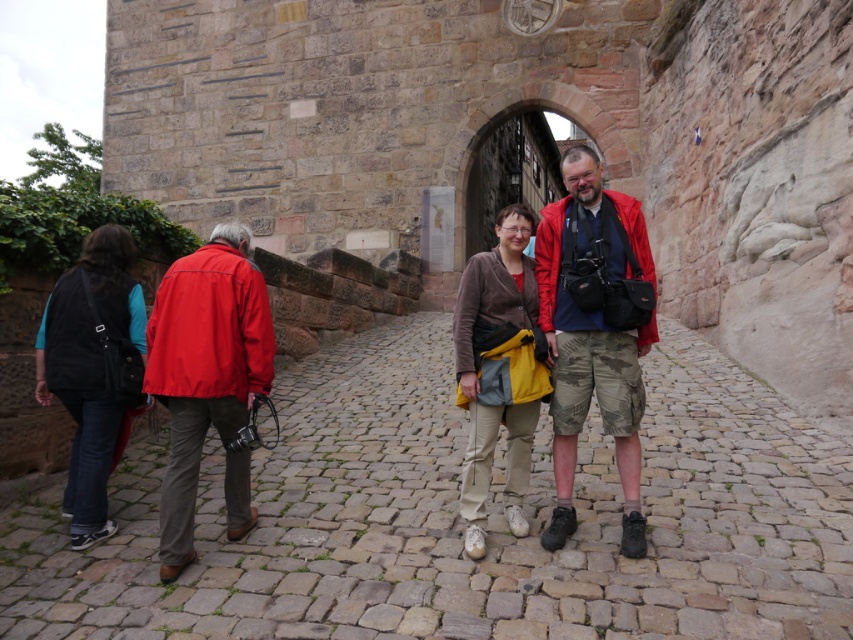
You are a photographer trying to capture a group photo of the two men and two women on the cobblestone pathway. You notice the matte red jacket at left and the camouflage shorts at center. Which object should you focus on first if you want to ensure both are in the frame without adjusting your camera angle?

You should focus on the camouflage shorts at center first because it is larger in size than the matte red jacket at left, making it easier to center in the frame while still including the smaller matte red jacket at left within the camera angle.